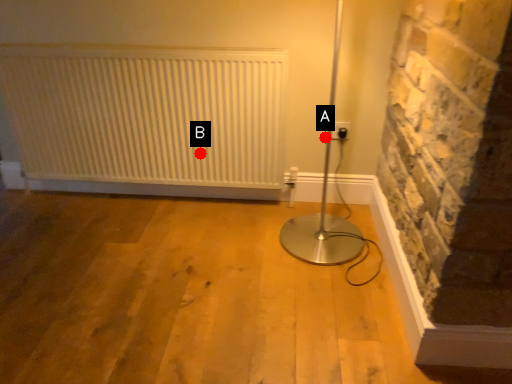
Question: Two points are circled on the image, labeled by A and B beside each circle. Which point is closer to the camera?

Choices:
 (A) A is closer
 (B) B is closer

Answer: (B)